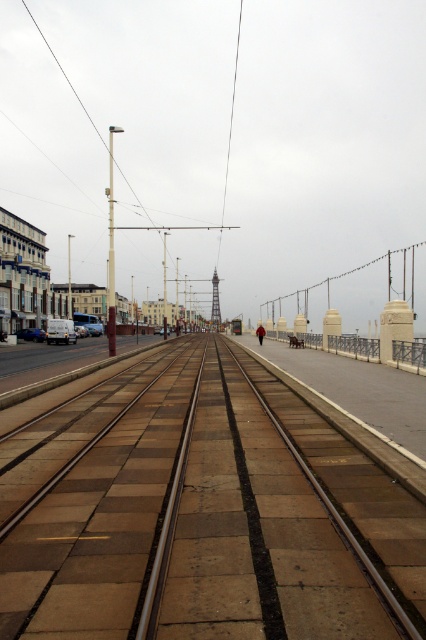
Consider the image. You are standing on the sidewalk next to the tram tracks and want to take a photo of the metallic gray tower at center. To ensure the brown concrete train track at center doesn not block your view, should you move to your left or right?

You should move to your right because the brown concrete train track at center is to the left of the metallic gray tower at center, so moving right would position the track behind you and keep the tower in view.

You are standing at the point marked by the coordinates point (x=203, y=515) in the image. What is the object located directly beneath your feet?

The point (x=203, y=515) indicates brown concrete train track at center, so the object directly beneath your feet is the brown concrete train track at center.

You are standing at the starting point of the brown concrete train track at center and want to reach the metallic gray tower at center. Which object would you see as larger as you walk towards them?

The metallic gray tower at center appears larger than the brown concrete train track at center as you approach them because the metallic gray tower at center is bigger in size compared to the brown concrete train track at center.